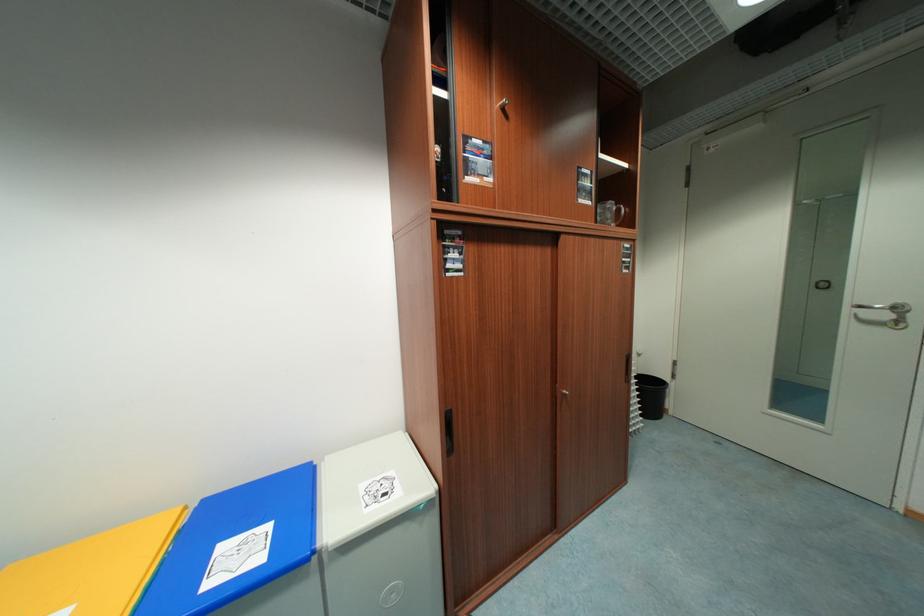
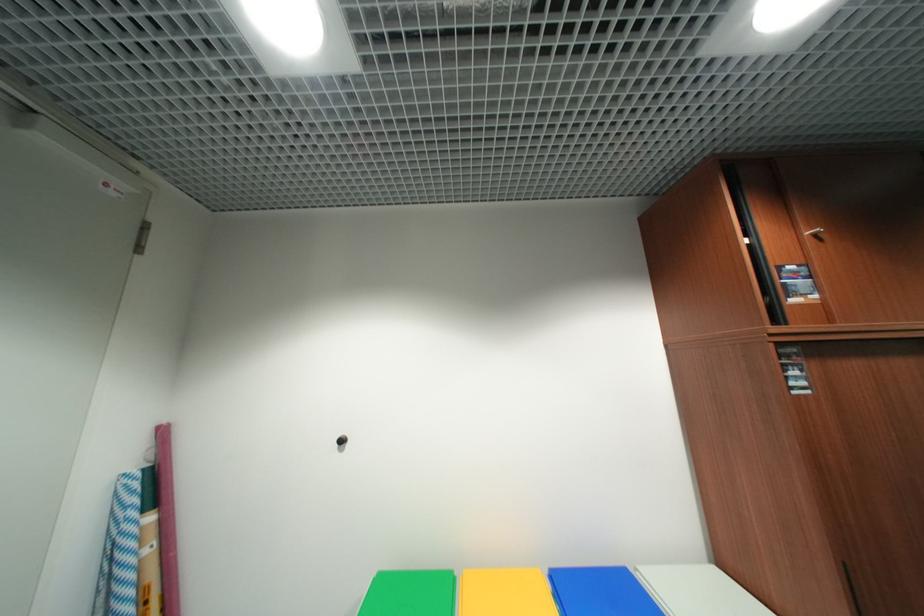
Based on the continuous images, in which direction is the camera rotating?

The camera's rotation is toward left-up.